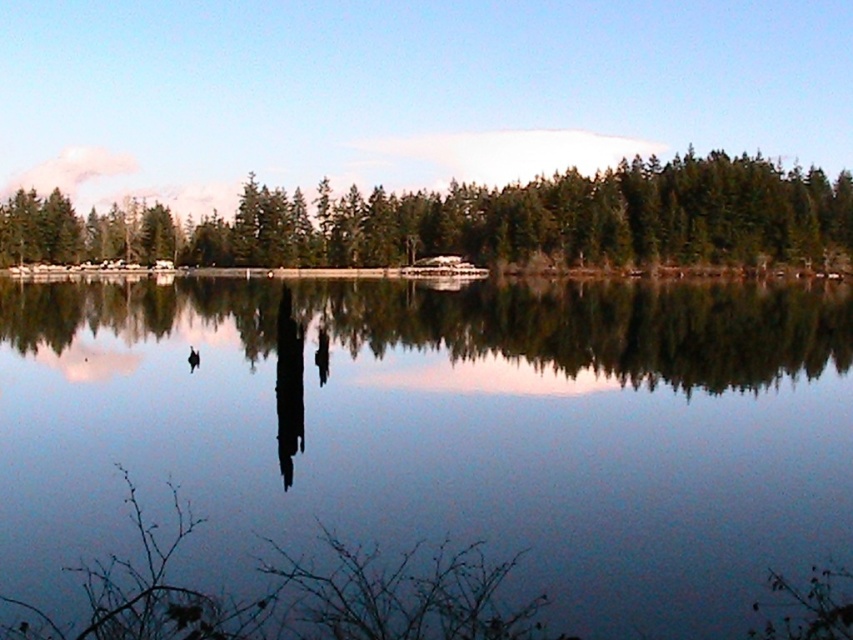
You are standing at the edge of the water and see the green matte trees at center and the white plastic boat at center. Which object is closer to you?

The white plastic boat at center is closer to you because the green matte trees at center are positioned over it, indicating that the boat is in front of the trees from your viewpoint.

You are standing at the edge of the water and want to look at the transparent water at center and the green matte trees at center. Which one do you see first?

The transparent water at center is closer to the viewer than the green matte trees at center, so you will see the transparent water at center first.